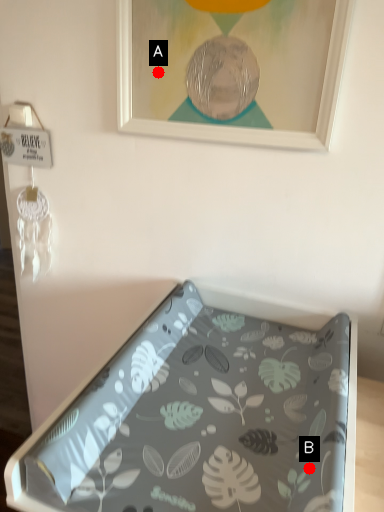
Question: Two points are circled on the image, labeled by A and B beside each circle. Among these points, which one is nearest to the camera?

Choices:
 (A) A is closer
 (B) B is closer

Answer: (B)